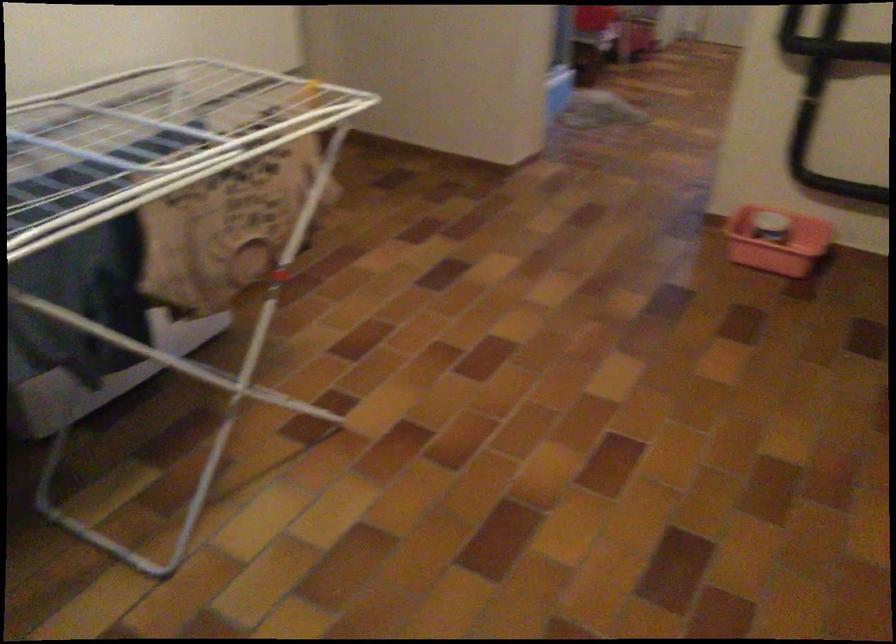
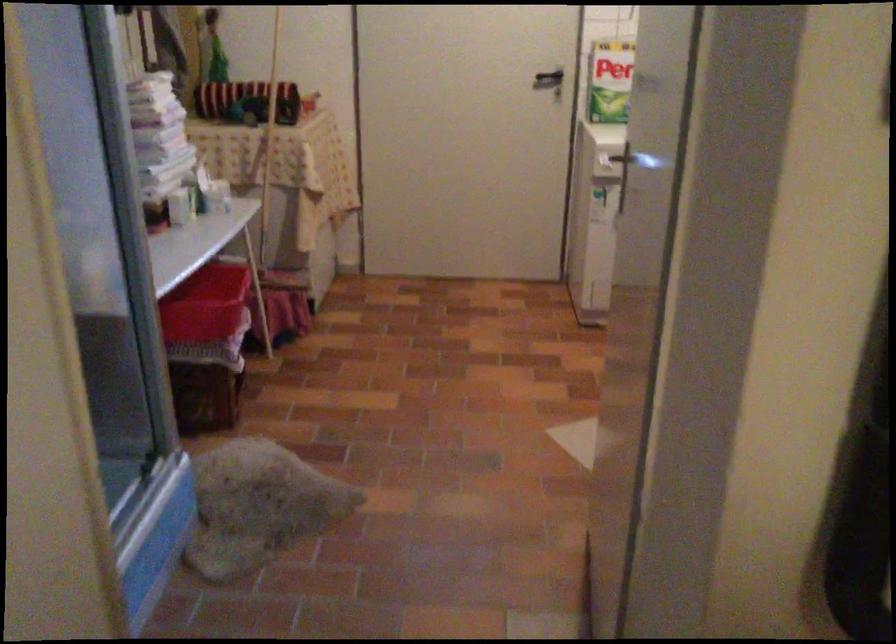
Question: In a continuous first-person perspective shot, in which direction is the camera moving?

Choices:
 (A) Left
 (B) Right
 (C) Forward
 (D) Backward

Answer: (C)